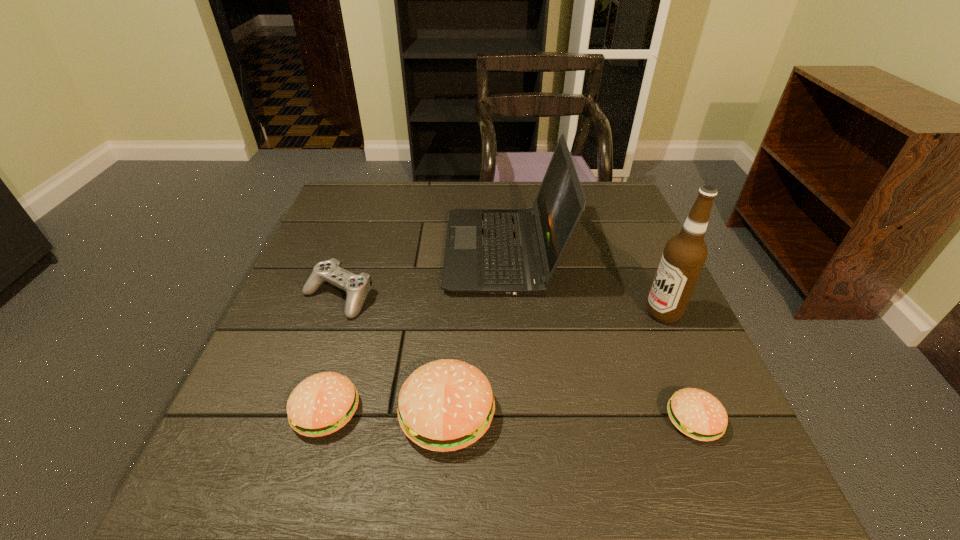
This screenshot has width=960, height=540. I want to click on free location located 0.060m on the back of the shortest patty, so click(674, 371).

Locate an element on the screen. free space located 0.120m on the label of the alcohol is located at coordinates (592, 313).

This screenshot has height=540, width=960. In order to click on free spot located 0.400m on the label of the alcohol in this screenshot , I will do `click(470, 313)`.

Find the location of a particular element. The height and width of the screenshot is (540, 960). free space located on the label of the alcohol is located at coordinates (619, 313).

Locate an element on the screen. free space located on the back of the control is located at coordinates (372, 199).

Locate an element on the screen. The height and width of the screenshot is (540, 960). vacant space located 0.220m on the screen of the fifth shortest object is located at coordinates (364, 252).

At what (x,y) coordinates should I click in order to perform the action: click on vacant space located on the screen of the fifth shortest object. Please return your answer as a coordinate pair (x, y). The image size is (960, 540). Looking at the image, I should click on (330, 252).

Locate an element on the screen. free space located on the screen of the fifth shortest object is located at coordinates (371, 252).

At what (x,y) coordinates should I click in order to perform the action: click on object that is positioned at the far edge. Please return your answer as a coordinate pair (x, y). The height and width of the screenshot is (540, 960). Looking at the image, I should click on (488, 251).

This screenshot has width=960, height=540. Identify the location of patty situated at the left edge. coord(323,403).